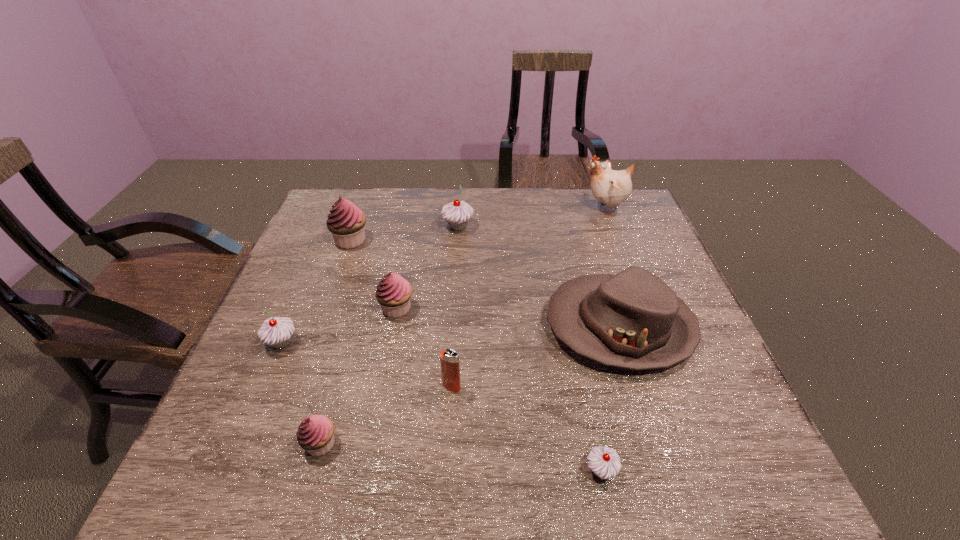
The image size is (960, 540). Find the location of `white bird`. white bird is located at coordinates (611, 187).

The width and height of the screenshot is (960, 540). In order to click on bird in this screenshot , I will do `click(611, 187)`.

Where is `the farthest gray cupcake`? the farthest gray cupcake is located at coordinates (458, 213).

Image resolution: width=960 pixels, height=540 pixels. Identify the location of the second gray cupcake from left to right. (458, 213).

Find the location of a particular element. The image size is (960, 540). the farthest pink cupcake is located at coordinates point(346,222).

Identify the location of hat. This screenshot has height=540, width=960. (633, 320).

Where is `the second biggest gray cupcake`? the second biggest gray cupcake is located at coordinates [x=276, y=331].

This screenshot has width=960, height=540. In order to click on the fourth farthest cupcake in this screenshot , I will do `click(276, 331)`.

Where is `the second farthest pink cupcake`? The width and height of the screenshot is (960, 540). the second farthest pink cupcake is located at coordinates (393, 293).

The height and width of the screenshot is (540, 960). Identify the location of the fourth cupcake from left to right. (393, 293).